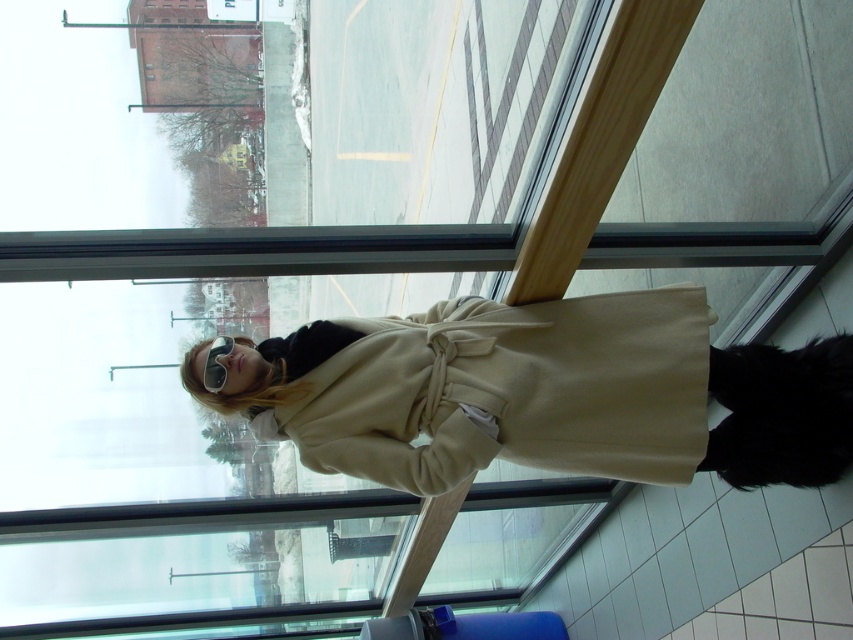
Who is lower down, beige wool coat at center or matte black goggles at center?

beige wool coat at center is lower down.

Which is above, beige wool coat at center or matte black goggles at center?

matte black goggles at center

Does point (727, 381) come closer to viewer compared to point (213, 387)?

No, (727, 381) is behind (213, 387).

I want to click on beige wool coat at center, so click(547, 394).